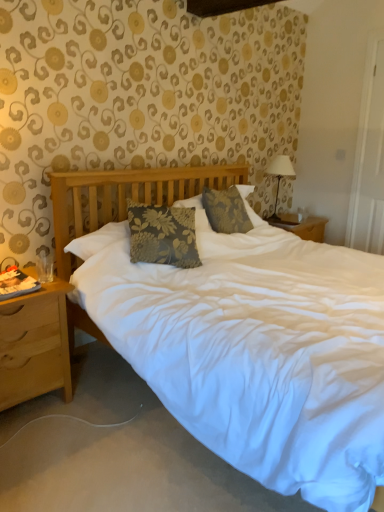
Question: Would you consider wooden nightstand at left to be distant from white fabric-covered lampshade at upper right?

Choices:
 (A) no
 (B) yes

Answer: (B)

Question: Considering the relative positions of wooden nightstand at left and white fabric-covered lampshade at upper right in the image provided, is wooden nightstand at left behind white fabric-covered lampshade at upper right?

Choices:
 (A) no
 (B) yes

Answer: (A)

Question: Can you confirm if wooden nightstand at left is thinner than white fabric-covered lampshade at upper right?

Choices:
 (A) yes
 (B) no

Answer: (B)

Question: Is wooden nightstand at left bigger than white fabric-covered lampshade at upper right?

Choices:
 (A) yes
 (B) no

Answer: (A)

Question: Is wooden nightstand at left positioned beyond the bounds of white fabric-covered lampshade at upper right?

Choices:
 (A) no
 (B) yes

Answer: (B)

Question: Is white fabric-covered lampshade at upper right taller or shorter than wooden nightstand at left?

Choices:
 (A) tall
 (B) short

Answer: (B)

Question: Is point (276, 205) positioned closer to the camera than point (41, 361)?

Choices:
 (A) closer
 (B) farther

Answer: (B)

Question: Is white fabric-covered lampshade at upper right to the left or to the right of wooden nightstand at left in the image?

Choices:
 (A) left
 (B) right

Answer: (B)

Question: Considering the positions of white fabric-covered lampshade at upper right and wooden nightstand at left in the image, is white fabric-covered lampshade at upper right wider or thinner than wooden nightstand at left?

Choices:
 (A) thin
 (B) wide

Answer: (A)

Question: Is floral fabric pillow at center to the left or to the right of wooden nightstand at left in the image?

Choices:
 (A) right
 (B) left

Answer: (A)

Question: Which is correct: floral fabric pillow at center is inside wooden nightstand at left, or outside of it?

Choices:
 (A) inside
 (B) outside

Answer: (B)

Question: Looking at the image, does floral fabric pillow at center seem bigger or smaller compared to wooden nightstand at left?

Choices:
 (A) small
 (B) big

Answer: (A)

Question: From a real-world perspective, is floral fabric pillow at center positioned above or below wooden nightstand at left?

Choices:
 (A) below
 (B) above

Answer: (B)

Question: In terms of height, does wooden nightstand at left look taller or shorter compared to white fabric-covered lampshade at upper right?

Choices:
 (A) short
 (B) tall

Answer: (B)

Question: Is wooden nightstand at left bigger or smaller than white fabric-covered lampshade at upper right?

Choices:
 (A) small
 (B) big

Answer: (B)